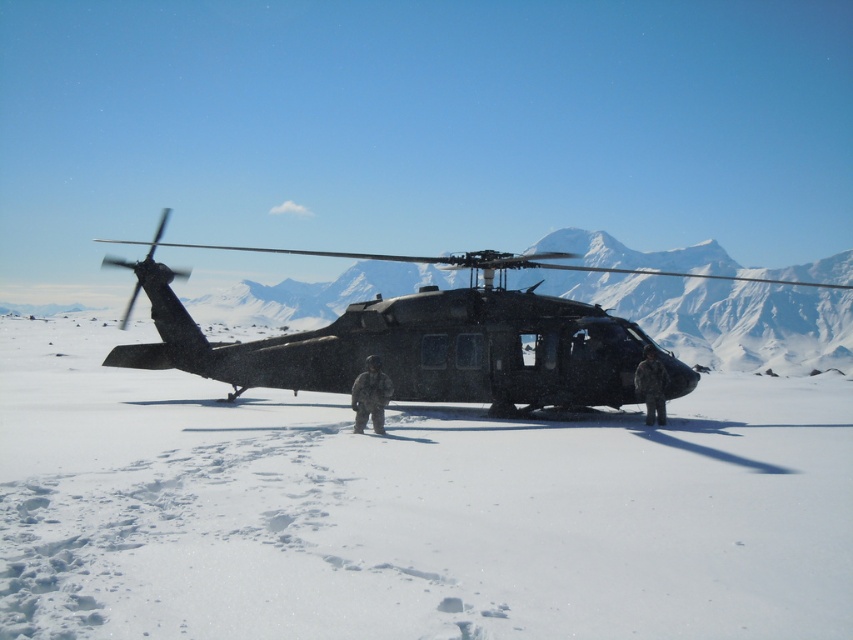
Question: Does camouflage uniform at center appear over camouflage fabric uniform at right?

Choices:
 (A) yes
 (B) no

Answer: (B)

Question: Is white powdery snow at center to the left of camouflage uniform at center from the viewer's perspective?

Choices:
 (A) no
 (B) yes

Answer: (A)

Question: Which point is closer to the camera?

Choices:
 (A) camouflage uniform at center
 (B) camouflage fabric uniform at right
 (C) white powdery snow at center
 (D) matte black helicopter at center

Answer: (C)

Question: Where is camouflage uniform at center located in relation to camouflage fabric uniform at right in the image?

Choices:
 (A) above
 (B) below

Answer: (B)

Question: Which object appears farthest from the camera in this image?

Choices:
 (A) white powdery snow at center
 (B) camouflage fabric uniform at right

Answer: (B)

Question: Among these objects, which one is farthest from the camera?

Choices:
 (A) matte black helicopter at center
 (B) camouflage fabric uniform at right

Answer: (B)